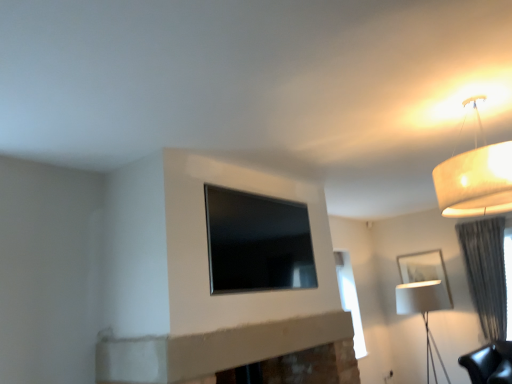
Question: Is white matte picture frame at right facing away from gray textured curtain at right?

Choices:
 (A) yes
 (B) no

Answer: (B)

Question: Is white matte picture frame at right thinner than gray textured curtain at right?

Choices:
 (A) yes
 (B) no

Answer: (A)

Question: Is white matte picture frame at right to the left of gray textured curtain at right from the viewer's perspective?

Choices:
 (A) no
 (B) yes

Answer: (B)

Question: From the image's perspective, is white matte picture frame at right above gray textured curtain at right?

Choices:
 (A) yes
 (B) no

Answer: (B)

Question: Is the depth of white matte picture frame at right less than that of gray textured curtain at right?

Choices:
 (A) no
 (B) yes

Answer: (A)

Question: From the image's perspective, is white matte picture frame at right located above or below white fabric lampshade at right, the first lamp viewed from the back?

Choices:
 (A) below
 (B) above

Answer: (B)

Question: From a real-world perspective, is white matte picture frame at right above or below white fabric lampshade at right, placed as the 2th lamp when sorted from front to back?

Choices:
 (A) above
 (B) below

Answer: (A)

Question: Based on their sizes in the image, would you say white matte picture frame at right is bigger or smaller than white fabric lampshade at right, placed as the second lamp when sorted from top to bottom?

Choices:
 (A) small
 (B) big

Answer: (A)

Question: Is white matte picture frame at right wider or thinner than white fabric lampshade at right, placed as the second lamp when sorted from top to bottom?

Choices:
 (A) thin
 (B) wide

Answer: (A)

Question: Is black glass window at center taller or shorter than gray textured curtain at right?

Choices:
 (A) tall
 (B) short

Answer: (B)

Question: From a real-world perspective, is black glass window at center physically located above or below gray textured curtain at right?

Choices:
 (A) below
 (B) above

Answer: (B)

Question: Is point (263, 218) positioned closer to the camera than point (486, 258)?

Choices:
 (A) closer
 (B) farther

Answer: (A)

Question: Do you think black glass window at center is within gray textured curtain at right, or outside of it?

Choices:
 (A) outside
 (B) inside

Answer: (A)

Question: From a real-world perspective, is matte white lampshade at upper right, the first lamp from the front, physically located above or below white matte picture frame at right?

Choices:
 (A) above
 (B) below

Answer: (A)

Question: From the image's perspective, relative to white matte picture frame at right, is matte white lampshade at upper right, positioned as the second lamp in back-to-front order, above or below?

Choices:
 (A) above
 (B) below

Answer: (A)